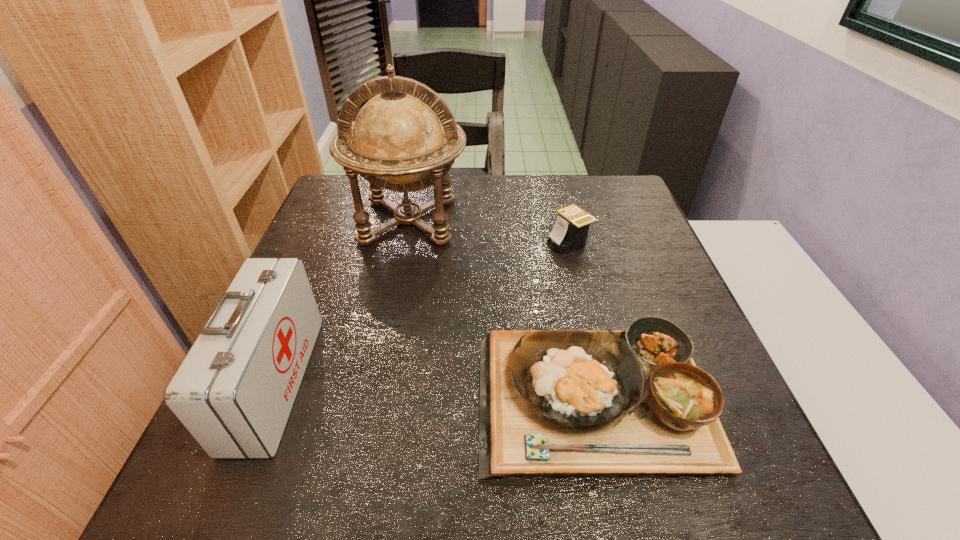
Find the location of a particular element. The width and height of the screenshot is (960, 540). the tallest object is located at coordinates (404, 139).

Where is `the second tallest object`? This screenshot has width=960, height=540. the second tallest object is located at coordinates (234, 390).

This screenshot has height=540, width=960. I want to click on calculator, so click(570, 232).

Locate an element on the screen. Image resolution: width=960 pixels, height=540 pixels. platter is located at coordinates (613, 403).

Identify the location of vacant space located 0.080m on the front-facing side of the globe. (396, 280).

Find the location of `free space located 0.180m on the front-facing side of the first-aid kit`. free space located 0.180m on the front-facing side of the first-aid kit is located at coordinates (399, 382).

I want to click on vacant area situated 0.090m on the back of the calculator, so click(562, 210).

This screenshot has height=540, width=960. What are the coordinates of `vacant area located on the back of the platter` in the screenshot? It's located at (559, 222).

Identify the location of object that is at the far edge. (404, 139).

Identify the location of the first-aid kit that is at the near edge. (234, 390).